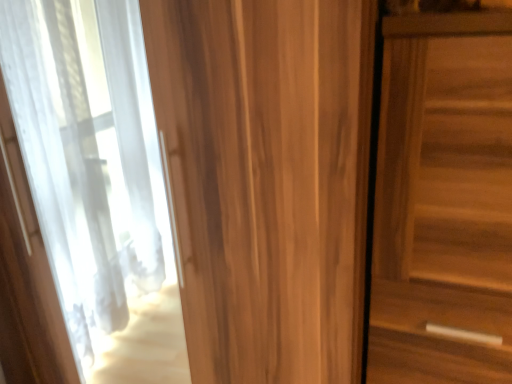
You are a GUI agent. You are given a task and a screenshot of the screen. Output one action in this format:
    pyautogui.click(x=<x>, y=<y>)
    Task: Click on the wooden door at center, which is the first door from left to right
    The width and height of the screenshot is (512, 384).
    Given the screenshot: What is the action you would take?
    pyautogui.click(x=267, y=180)

What is the approximate width of wooden door at center, which is the 2th door in right-to-left order?

It is 60.31 centimeters.

The width and height of the screenshot is (512, 384). Describe the element at coordinates (267, 180) in the screenshot. I see `wooden door at center, which is the 2th door in right-to-left order` at that location.

What is the approximate height of wooden door at center, which is the first door from left to right?

→ It is 4.93 feet.

The width and height of the screenshot is (512, 384). What do you see at coordinates (443, 202) in the screenshot? I see `wooden door at right, marked as the 1th door in a right-to-left arrangement` at bounding box center [443, 202].

At what (x,y) coordinates should I click in order to perform the action: click on wooden door at right, marked as the 1th door in a right-to-left arrangement. Please return your answer as a coordinate pair (x, y). This screenshot has height=384, width=512. Looking at the image, I should click on (443, 202).

The height and width of the screenshot is (384, 512). Find the location of `wooden door at center, which is the 2th door in right-to-left order`. wooden door at center, which is the 2th door in right-to-left order is located at coordinates (267, 180).

Is wooden door at right, marked as the 1th door in a right-to-left arrangement, to the left or to the right of wooden door at center, which is the 2th door in right-to-left order, in the image?

Based on their positions, wooden door at right, marked as the 1th door in a right-to-left arrangement, is located to the right of wooden door at center, which is the 2th door in right-to-left order.

Is the position of wooden door at right, marked as the 1th door in a right-to-left arrangement, more distant than that of wooden door at center, which is the 2th door in right-to-left order?

Yes, it is.

Between point (476, 350) and point (173, 93), which one is positioned behind?

Positioned behind is point (476, 350).

From the image's perspective, relative to wooden door at center, which is the first door from left to right, is wooden door at right, which is counted as the second door, starting from the left, above or below?

From the image's perspective, wooden door at right, which is counted as the second door, starting from the left, appears below wooden door at center, which is the first door from left to right.

From a real-world perspective, which object rests below the other?

In real-world perspective, wooden door at center, which is the first door from left to right, is lower.

Considering the relative sizes of wooden door at right, which is counted as the second door, starting from the left, and wooden door at center, which is the 2th door in right-to-left order, in the image provided, is wooden door at right, which is counted as the second door, starting from the left, thinner than wooden door at center, which is the 2th door in right-to-left order,?

Yes.

Is wooden door at right, marked as the 1th door in a right-to-left arrangement, shorter than wooden door at center, which is the 2th door in right-to-left order?

Correct, wooden door at right, marked as the 1th door in a right-to-left arrangement, is not as tall as wooden door at center, which is the 2th door in right-to-left order.

Does wooden door at right, which is counted as the second door, starting from the left, have a smaller size compared to wooden door at center, which is the 2th door in right-to-left order?

Correct, wooden door at right, which is counted as the second door, starting from the left, occupies less space than wooden door at center, which is the 2th door in right-to-left order.

Is wooden door at right, marked as the 1th door in a right-to-left arrangement, outside of wooden door at center, which is the first door from left to right?

Absolutely, wooden door at right, marked as the 1th door in a right-to-left arrangement, is external to wooden door at center, which is the first door from left to right.

Is wooden door at right, marked as the 1th door in a right-to-left arrangement, far from wooden door at center, which is the first door from left to right?

wooden door at right, marked as the 1th door in a right-to-left arrangement, is near wooden door at center, which is the first door from left to right, not far away.

Is wooden door at right, marked as the 1th door in a right-to-left arrangement, oriented away from wooden door at center, which is the first door from left to right?

No, wooden door at center, which is the first door from left to right, is not at the back of wooden door at right, marked as the 1th door in a right-to-left arrangement.

Where is `door above the wooden door at right, which is counted as the second door, starting from the left (from the image's perspective)`? door above the wooden door at right, which is counted as the second door, starting from the left (from the image's perspective) is located at coordinates (267, 180).

Can you confirm if wooden door at center, which is the first door from left to right, is positioned to the left of wooden door at right, marked as the 1th door in a right-to-left arrangement?

Correct, you'll find wooden door at center, which is the first door from left to right, to the left of wooden door at right, marked as the 1th door in a right-to-left arrangement.

In the image, is wooden door at center, which is the 2th door in right-to-left order, positioned in front of or behind wooden door at right, which is counted as the second door, starting from the left?

Clearly, wooden door at center, which is the 2th door in right-to-left order, is in front of wooden door at right, which is counted as the second door, starting from the left.

Which point is more distant from viewer, [362,251] or [509,327]?

Point [509,327]

From the image's perspective, between wooden door at center, which is the 2th door in right-to-left order, and wooden door at right, marked as the 1th door in a right-to-left arrangement, which one is located above?

wooden door at center, which is the 2th door in right-to-left order, from the image's perspective.

From a real-world perspective, which object rests below the other?

From a 3D spatial view, wooden door at center, which is the 2th door in right-to-left order, is below.

Which object is thinner, wooden door at center, which is the 2th door in right-to-left order, or wooden door at right, marked as the 1th door in a right-to-left arrangement?

Thinner between the two is wooden door at right, marked as the 1th door in a right-to-left arrangement.

Considering the relative sizes of wooden door at center, which is the first door from left to right, and wooden door at right, which is counted as the second door, starting from the left, in the image provided, is wooden door at center, which is the first door from left to right, taller than wooden door at right, which is counted as the second door, starting from the left,?

Yes.

Who is smaller, wooden door at center, which is the 2th door in right-to-left order, or wooden door at right, marked as the 1th door in a right-to-left arrangement?

wooden door at right, marked as the 1th door in a right-to-left arrangement, is smaller.

Do you think wooden door at center, which is the 2th door in right-to-left order, is within wooden door at right, which is counted as the second door, starting from the left, or outside of it?

wooden door at center, which is the 2th door in right-to-left order, is outside wooden door at right, which is counted as the second door, starting from the left.

Is wooden door at center, which is the 2th door in right-to-left order, not near wooden door at right, marked as the 1th door in a right-to-left arrangement?

No, wooden door at center, which is the 2th door in right-to-left order, is not far away from wooden door at right, marked as the 1th door in a right-to-left arrangement.

Could you tell me if wooden door at center, which is the 2th door in right-to-left order, is turned towards wooden door at right, marked as the 1th door in a right-to-left arrangement?

No, wooden door at center, which is the 2th door in right-to-left order, is not facing towards wooden door at right, marked as the 1th door in a right-to-left arrangement.

How far apart are wooden door at center, which is the first door from left to right, and wooden door at right, which is counted as the second door, starting from the left?

wooden door at center, which is the first door from left to right, and wooden door at right, which is counted as the second door, starting from the left, are 9.42 inches apart from each other.

The image size is (512, 384). Identify the location of door behind the wooden door at center, which is the first door from left to right. (443, 202).

Where is `door above the wooden door at center, which is the first door from left to right (from a real-world perspective)`? door above the wooden door at center, which is the first door from left to right (from a real-world perspective) is located at coordinates (443, 202).

Where is `door above the wooden door at right, marked as the 1th door in a right-to-left arrangement (from the image's perspective)`? This screenshot has height=384, width=512. door above the wooden door at right, marked as the 1th door in a right-to-left arrangement (from the image's perspective) is located at coordinates (267, 180).